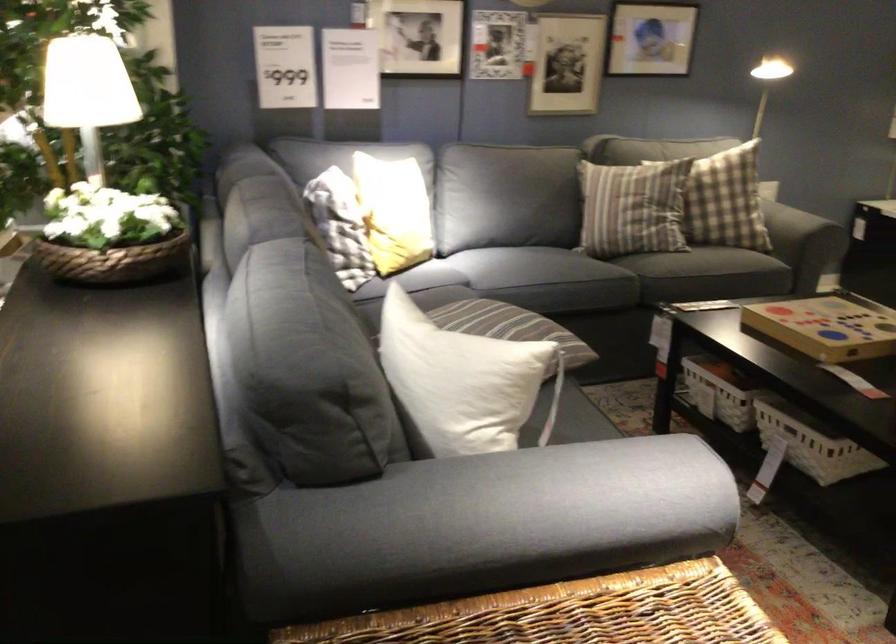
The image size is (896, 644). Find the location of `striped throw pillow`. striped throw pillow is located at coordinates (633, 207).